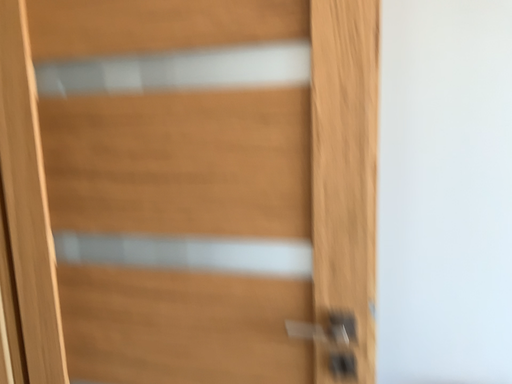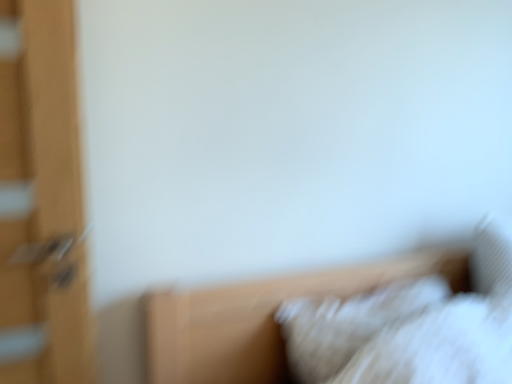
Question: Which way did the camera rotate in the video?

Choices:
 (A) rotated left
 (B) rotated right

Answer: (B)